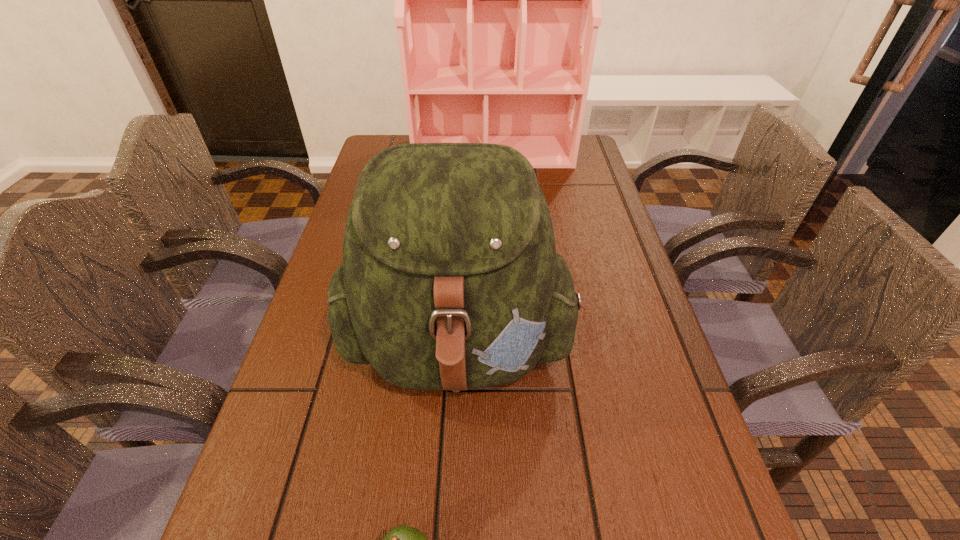
Where is `object at the far left corner`? This screenshot has height=540, width=960. object at the far left corner is located at coordinates (497, 0).

Find the location of a particular element. The height and width of the screenshot is (540, 960). object that is at the far right corner is located at coordinates (497, 0).

Find the location of a particular element. This screenshot has height=540, width=960. vacant space at the left edge of the desktop is located at coordinates (362, 382).

Find the location of a particular element. The width and height of the screenshot is (960, 540). vacant space at the right edge is located at coordinates (564, 178).

Locate an element on the screen. This screenshot has width=960, height=540. vacant region at the far left corner is located at coordinates (394, 137).

This screenshot has height=540, width=960. In order to click on vacant position at the far right corner of the desktop in this screenshot , I will do `click(582, 170)`.

Identify which object is the closest to the shortest object. Please provide its 2D coordinates. Your answer should be formatted as a tuple, i.e. [(x, y)], where the tuple contains the x and y coordinates of a point satisfying the conditions above.

[(450, 279)]

Find the location of a particular element. This screenshot has width=960, height=540. object that stands as the closest to the tallest object is located at coordinates (450, 279).